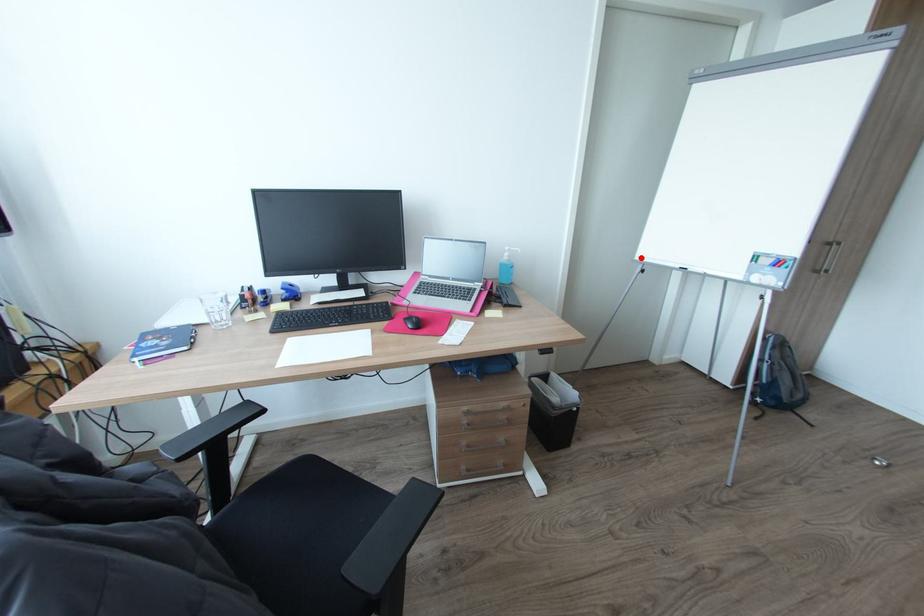
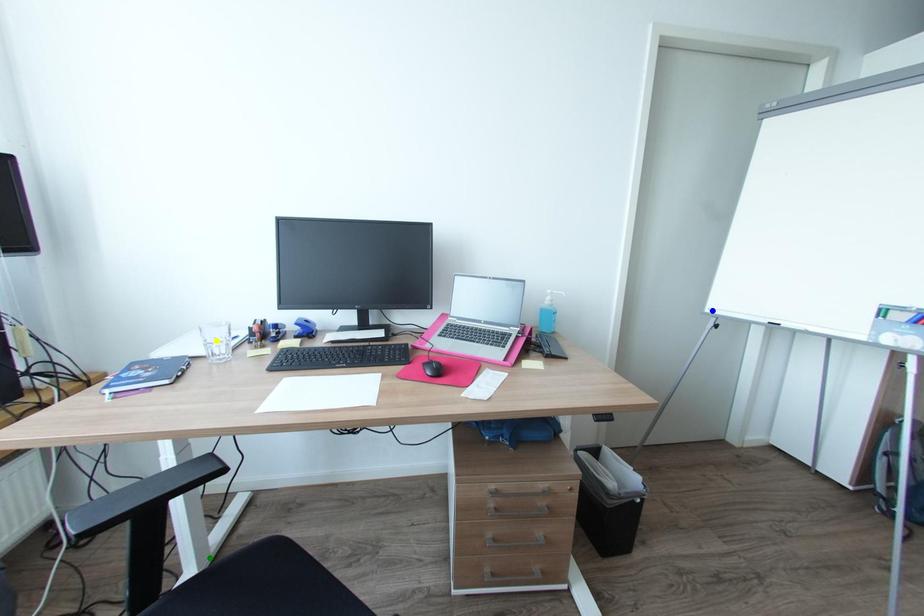
Question: I am providing you with two images of the same scene from different viewpoints. A red point is marked on the first image. You are given multiple points on the second image. In image 2, which mark is for the same physical point as the one in image 1?

Choices:
 (A) blue point
 (B) yellow point
 (C) green point

Answer: (A)